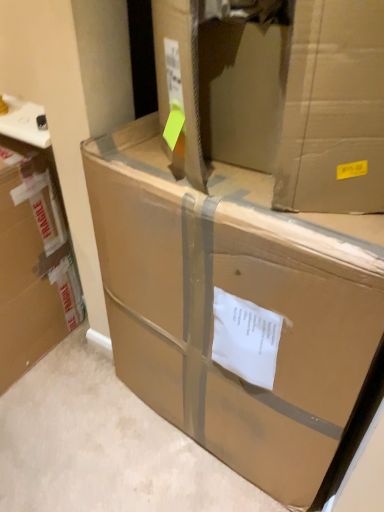
Question: Can you confirm if brown cardboard box at left, positioned as the second box in right-to-left order, is smaller than brown cardboard box at center, which ranks as the 1th box in right-to-left order?

Choices:
 (A) yes
 (B) no

Answer: (A)

Question: Considering the relative sizes of brown cardboard box at left, positioned as the second box in right-to-left order, and brown cardboard box at center, which ranks as the 1th box in right-to-left order, in the image provided, is brown cardboard box at left, positioned as the second box in right-to-left order, taller than brown cardboard box at center, which ranks as the 1th box in right-to-left order,?

Choices:
 (A) no
 (B) yes

Answer: (A)

Question: Does brown cardboard box at left, which is the first box from left to right, contain brown cardboard box at center, which ranks as the 1th box in right-to-left order?

Choices:
 (A) yes
 (B) no

Answer: (B)

Question: Can you confirm if brown cardboard box at left, positioned as the second box in right-to-left order, is bigger than brown cardboard box at center, which ranks as the 1th box in right-to-left order?

Choices:
 (A) no
 (B) yes

Answer: (A)

Question: Is brown cardboard box at left, which is the first box from left to right, further to the viewer compared to brown cardboard box at center, which ranks as the 1th box in right-to-left order?

Choices:
 (A) yes
 (B) no

Answer: (A)

Question: Does brown cardboard box at left, positioned as the second box in right-to-left order, have a lesser width compared to brown cardboard box at center, which is the 2th box from left to right?

Choices:
 (A) no
 (B) yes

Answer: (B)

Question: Is brown cardboard box at left, which is the first box from left to right, at the back of brown cardboard box at center, which is the 2th box from left to right?

Choices:
 (A) yes
 (B) no

Answer: (B)

Question: From a real-world perspective, is brown cardboard box at center, which ranks as the 1th box in right-to-left order, under brown cardboard box at left, positioned as the second box in right-to-left order?

Choices:
 (A) no
 (B) yes

Answer: (A)

Question: Is brown cardboard box at center, which ranks as the 1th box in right-to-left order, shorter than brown cardboard box at left, positioned as the second box in right-to-left order?

Choices:
 (A) yes
 (B) no

Answer: (B)

Question: Does brown cardboard box at center, which ranks as the 1th box in right-to-left order, appear on the right side of brown cardboard box at left, which is the first box from left to right?

Choices:
 (A) no
 (B) yes

Answer: (B)

Question: Considering the relative sizes of brown cardboard box at center, which ranks as the 1th box in right-to-left order, and brown cardboard box at left, positioned as the second box in right-to-left order, in the image provided, is brown cardboard box at center, which ranks as the 1th box in right-to-left order, bigger than brown cardboard box at left, positioned as the second box in right-to-left order,?

Choices:
 (A) no
 (B) yes

Answer: (B)

Question: From the image's perspective, is brown cardboard box at center, which is the 2th box from left to right, below brown cardboard box at left, which is the first box from left to right?

Choices:
 (A) yes
 (B) no

Answer: (A)

Question: Does point (21, 254) appear closer or farther from the camera than point (312, 254)?

Choices:
 (A) closer
 (B) farther

Answer: (B)